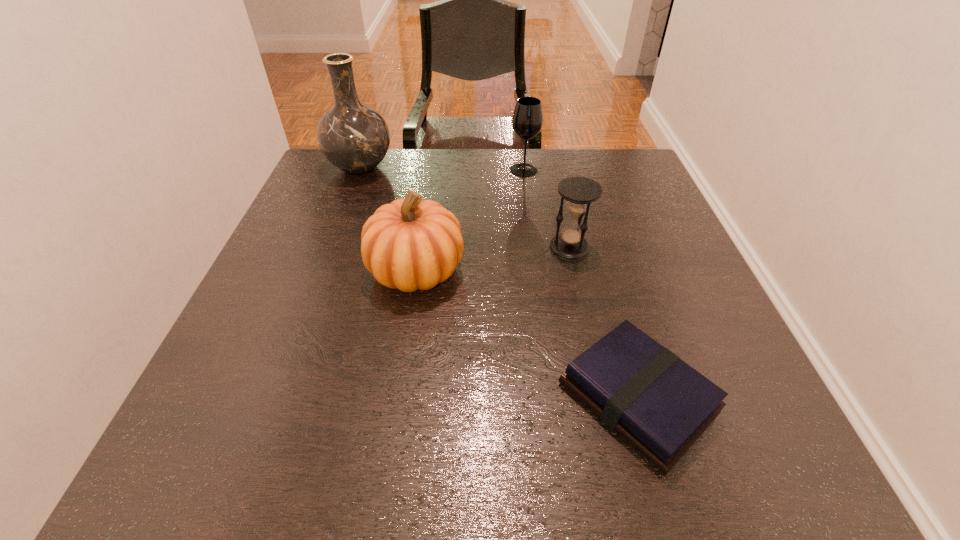
Locate an element on the screen. This screenshot has height=540, width=960. free point between the hourglass and the book is located at coordinates (604, 323).

Where is `free spot between the second shortest object and the pumpkin`? Image resolution: width=960 pixels, height=540 pixels. free spot between the second shortest object and the pumpkin is located at coordinates (492, 259).

The height and width of the screenshot is (540, 960). I want to click on free spot between the shortest object and the fourth tallest object, so click(604, 323).

Identify the location of the closest object to the wineglass. (579, 192).

Locate which object is the third closest to the leftmost object. Please provide its 2D coordinates. Your answer should be formatted as a tuple, i.e. [(x, y)], where the tuple contains the x and y coordinates of a point satisfying the conditions above.

[(579, 192)]

I want to click on vacant space that satisfies the following two spatial constraints: 1. on the front side of the hourglass; 2. on the right side of the shortest object, so click(604, 398).

I want to click on vacant position in the image that satisfies the following two spatial constraints: 1. on the front side of the nearest object; 2. on the left side of the wineglass, so click(555, 398).

Where is `vacant space that satisfies the following two spatial constraints: 1. on the front side of the second shortest object; 2. on the right side of the wineglass`? This screenshot has height=540, width=960. vacant space that satisfies the following two spatial constraints: 1. on the front side of the second shortest object; 2. on the right side of the wineglass is located at coordinates (535, 247).